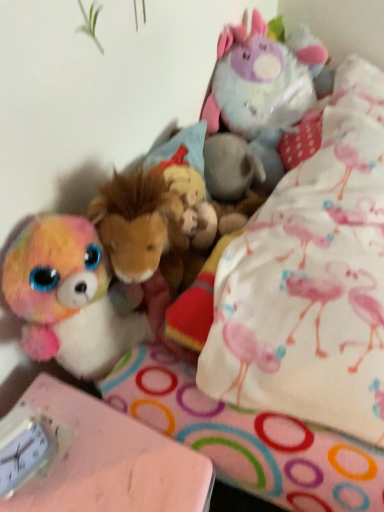
Identify the location of blank space situated above pink matte table at lower left (from a real-world perspective). (92, 459).